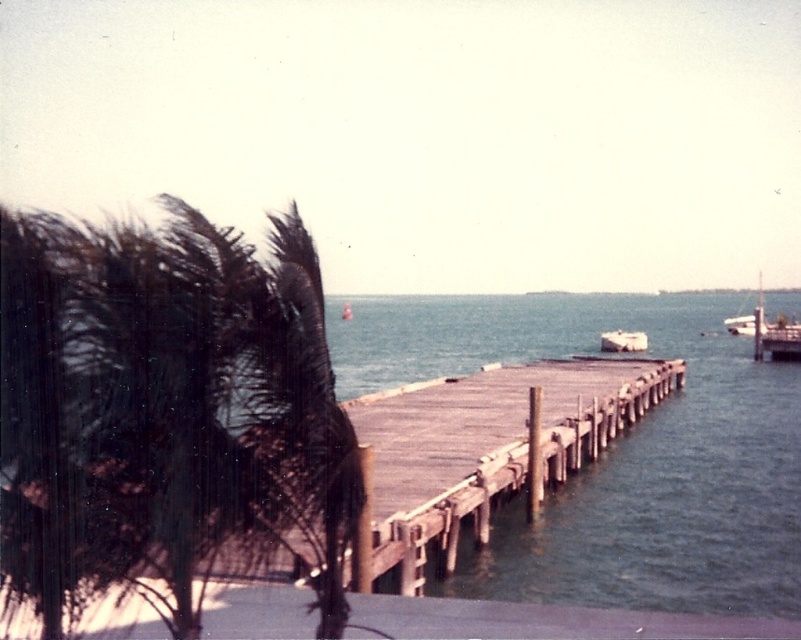
Does white matte boat at center appear on the right side of white glossy boat at right?

In fact, white matte boat at center is to the left of white glossy boat at right.

Which is behind, point (630, 340) or point (751, 317)?

Positioned behind is point (751, 317).

Where is `white matte boat at center`? white matte boat at center is located at coordinates (622, 340).

Does dark green fronds at left appear on the left side of wooden dock at center?

Yes, dark green fronds at left is to the left of wooden dock at center.

Is point (206, 323) behind point (497, 456)?

No, it is in front of (497, 456).

This screenshot has height=640, width=801. Find the location of `dark green fronds at left`. dark green fronds at left is located at coordinates (164, 410).

Is dark green fronds at left to the left of white matte boat at center from the viewer's perspective?

Correct, you'll find dark green fronds at left to the left of white matte boat at center.

Between point (129, 492) and point (638, 342), which one is positioned behind?

Positioned behind is point (638, 342).

Find the location of a particular element. This screenshot has width=801, height=640. dark green fronds at left is located at coordinates (164, 410).